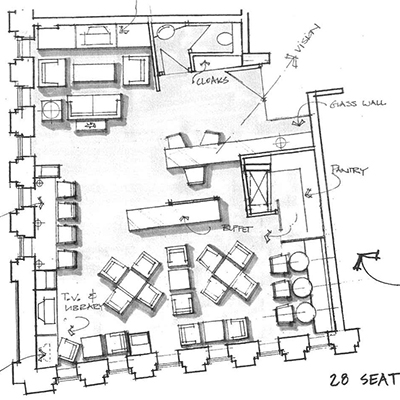
Find the location of a particular element. floor is located at coordinates (116, 177).